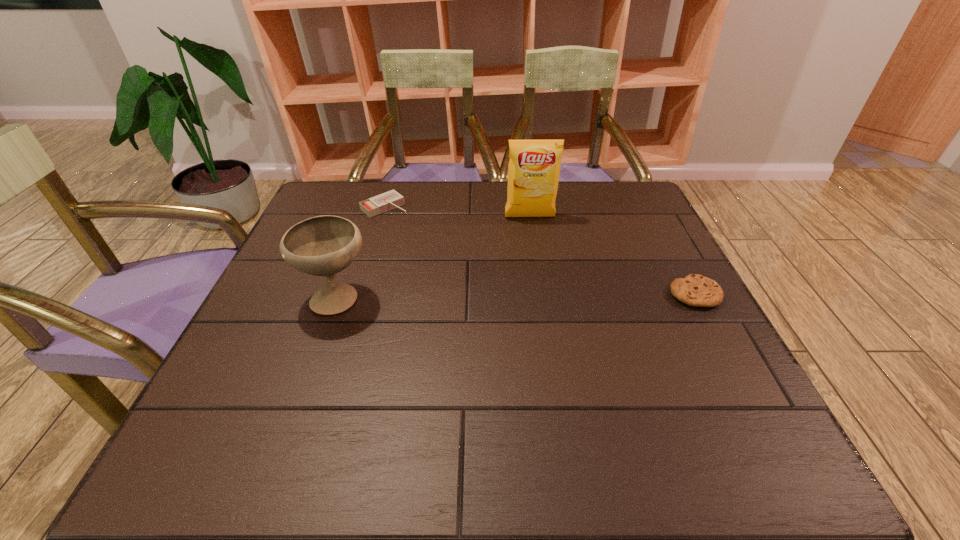
Where is `the second tallest object`? The image size is (960, 540). the second tallest object is located at coordinates (324, 245).

Where is `the rightmost object`? This screenshot has width=960, height=540. the rightmost object is located at coordinates (696, 290).

The image size is (960, 540). Find the location of `crisp (potato chip)`. crisp (potato chip) is located at coordinates (534, 167).

Identify the location of the tallest object. (534, 167).

Locate an element on the screen. matchbox is located at coordinates (389, 200).

Locate an element on the screen. This screenshot has width=960, height=540. vacant space located 0.310m on the right of the third shortest object is located at coordinates (513, 297).

Where is `free location located on the left of the cookie`? free location located on the left of the cookie is located at coordinates (588, 294).

Locate an element on the screen. The width and height of the screenshot is (960, 540). free location located on the front of the crisp (potato chip) with the logo is located at coordinates (542, 286).

The width and height of the screenshot is (960, 540). In order to click on vacant space located on the front of the crisp (potato chip) with the logo in this screenshot , I will do `click(548, 318)`.

Locate an element on the screen. vacant space located 0.070m on the front of the crisp (potato chip) with the logo is located at coordinates (534, 237).